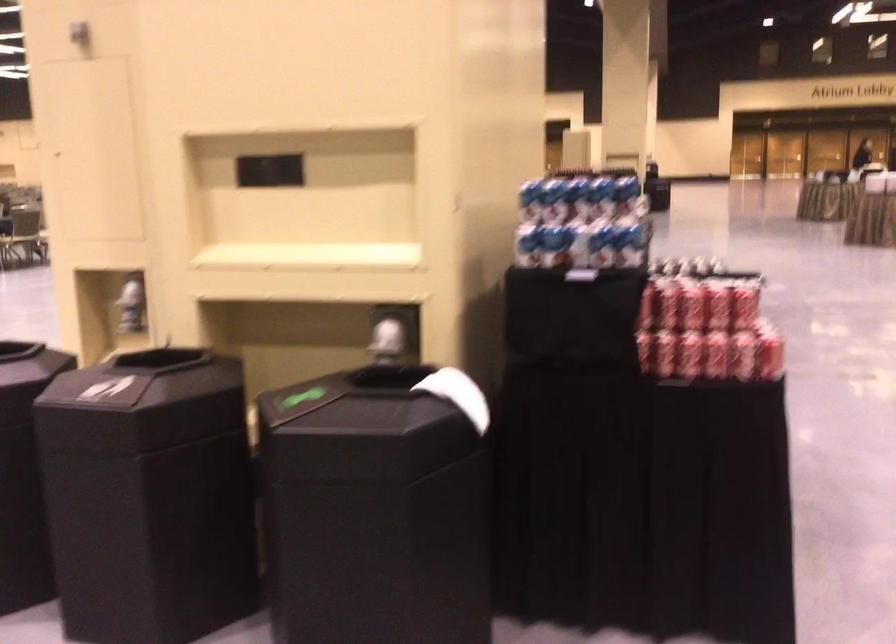
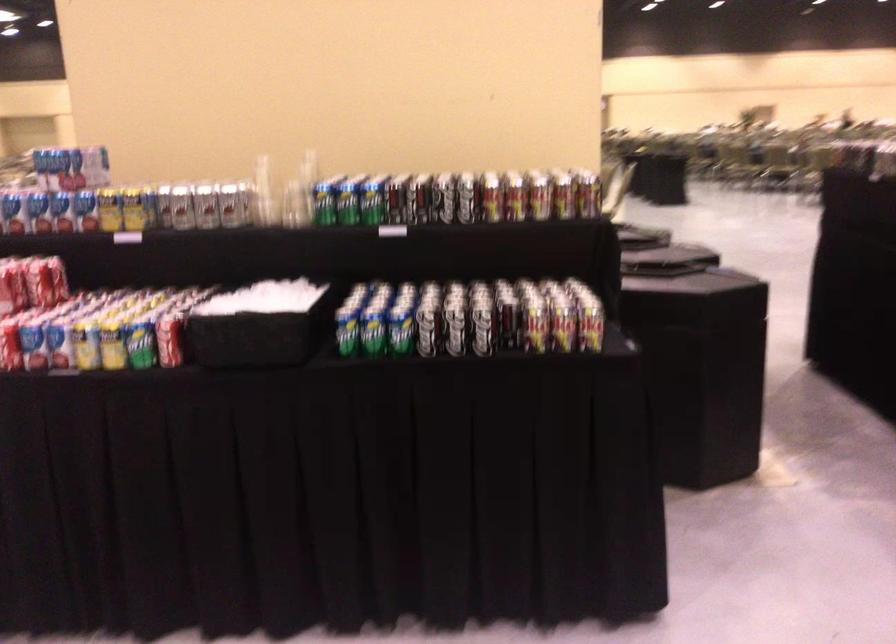
In the second image, find the point that corresponds to (x=650, y=241) in the first image.

(13, 209)